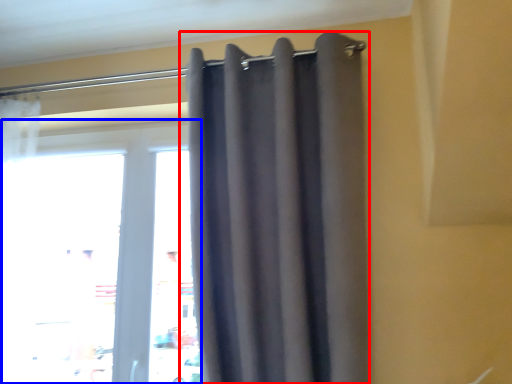
Question: Among these objects, which one is farthest to the camera, curtain (highlighted by a red box) or window (highlighted by a blue box)?

Choices:
 (A) curtain
 (B) window

Answer: (B)